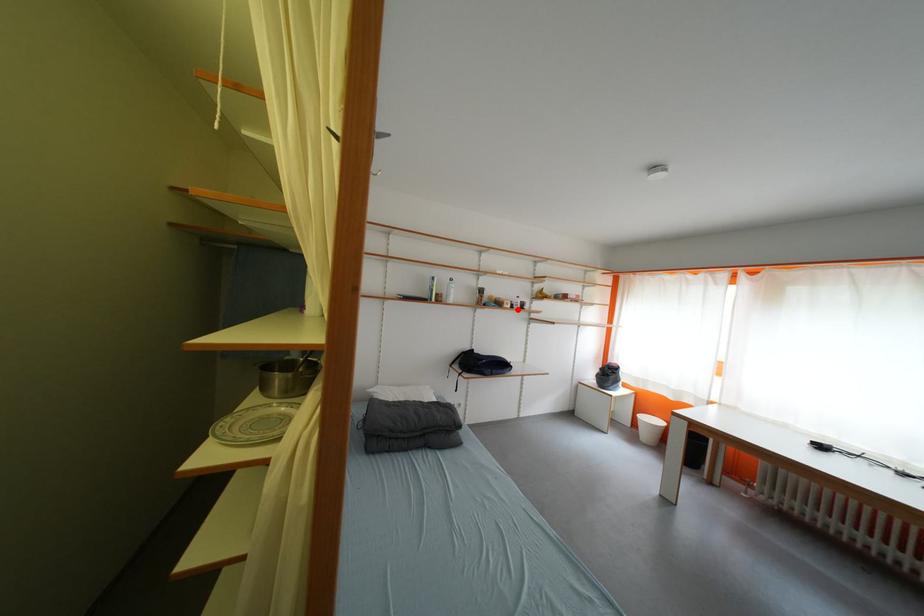
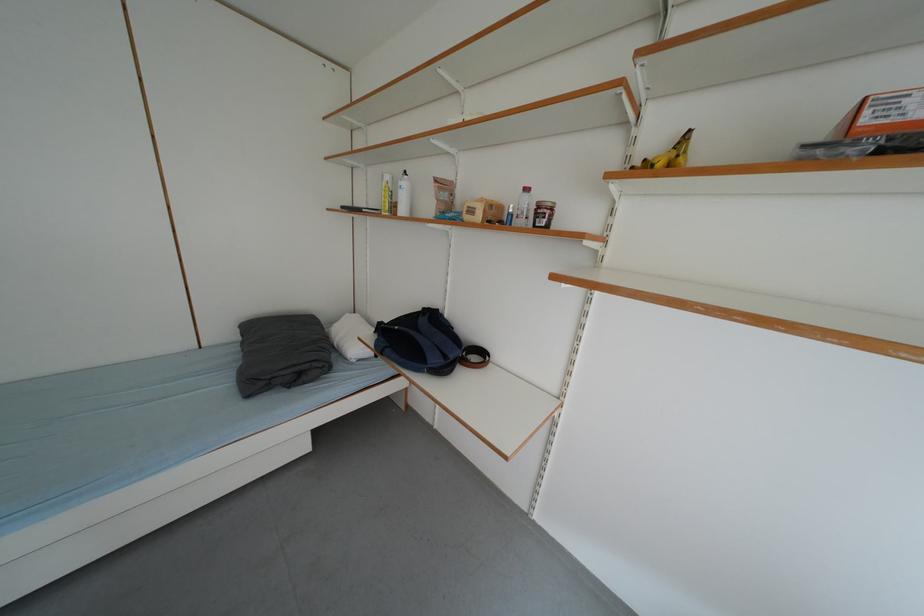
The point at the highlighted location is marked in the first image. Where is the corresponding point in the second image?

(487, 220)